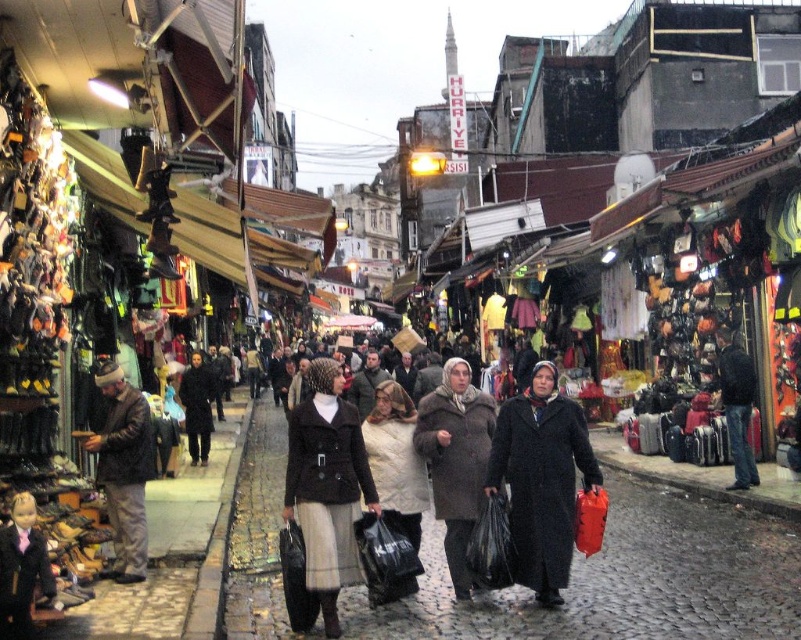
Question: Which object is closer to the camera taking this photo?

Choices:
 (A) black matte coat at center
 (B) dark gray cobblestone pavement at center
 (C) matte black coat at center
 (D) dark brown leather jacket at left

Answer: (B)

Question: Is matte black coat at center to the right of dark brown leather jacket at left from the viewer's perspective?

Choices:
 (A) no
 (B) yes

Answer: (B)

Question: Where is brown fur coat at center located in relation to dark blue leather jacket at right in the image?

Choices:
 (A) right
 (B) left

Answer: (B)

Question: Among these points, which one is farthest from the camera?

Choices:
 (A) (51, 588)
 (B) (743, 413)
 (C) (103, 458)
 (D) (560, 561)

Answer: (B)

Question: Does matte black coat at center have a greater width compared to smooth black coat at lower left?

Choices:
 (A) yes
 (B) no

Answer: (A)

Question: Which object appears closest to the camera in this image?

Choices:
 (A) black matte coat at center
 (B) dark gray cobblestone pavement at center

Answer: (B)